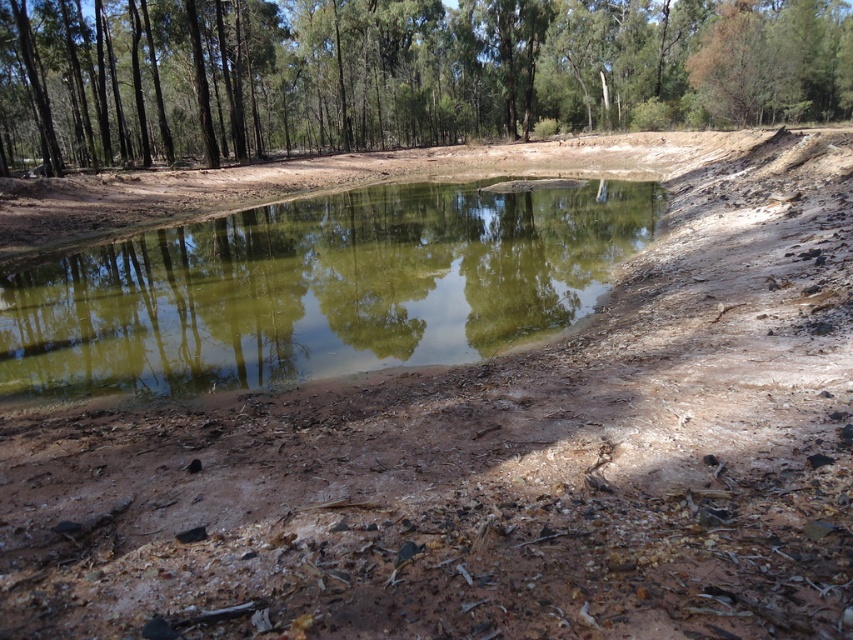
You are standing at the edge of the pond and want to look at both the green leafy tree at upper center and the green reflective water at center. Which object is positioned to the right side when viewed from your perspective?

The green leafy tree at upper center is to the right of the green reflective water at center, so when viewed from your perspective at the edge of the pond, the green leafy tree at upper center is positioned to the right side.

You are standing at the edge of the pond and want to see the reflection of the green leafy tree at upper center in the green reflective water at center. Is the reflection visible?

The green leafy tree at upper center is located above green reflective water at center, so its reflection should be visible in the water.

You are standing at the edge of the pond and notice a green leafy tree at upper center. If you want to walk directly towards it from your current position, which direction should you head?

The green leafy tree at upper center is located at point coordinates, so you should head north to reach it.